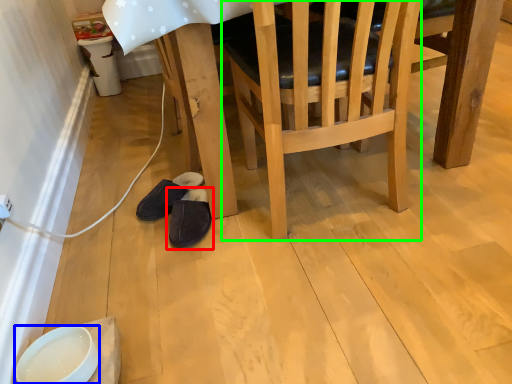
Question: Which object is positioned farthest from footwear (highlighted by a red box)? Select from bowl (highlighted by a blue box) and chair (highlighted by a green box).

Choices:
 (A) bowl
 (B) chair

Answer: (B)